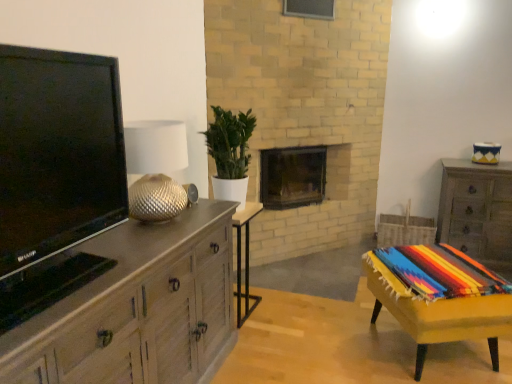
Question: Choose the correct answer: Is wooden side table at center, which is the second table from right to left, inside matte black tv at left or outside it?

Choices:
 (A) outside
 (B) inside

Answer: (A)

Question: In terms of width, does wooden side table at center, which is the second table from right to left, look wider or thinner when compared to matte black tv at left?

Choices:
 (A) thin
 (B) wide

Answer: (A)

Question: Which object is positioned farthest from the green leafy plant at center?

Choices:
 (A) yellow fabric-covered table at lower right, the second table when ordered from left to right
 (B) dark brown wood fireplace at center
 (C) wooden chest of drawers at right, positioned as the 1th chest of drawers in back-to-front order
 (D) multicolored woven blanket at lower right
 (E) light wood/wooden chest of drawers at left, the 1th chest of drawers positioned from the front

Answer: (C)

Question: Which object is the closest to the dark brown wood fireplace at center?

Choices:
 (A) matte black tv at left
 (B) multicolored woven blanket at lower right
 (C) yellow fabric-covered table at lower right, the second table when ordered from left to right
 (D) wooden side table at center, the first table from the left
 (E) light wood/wooden chest of drawers at left, the 1th chest of drawers positioned from the front

Answer: (D)